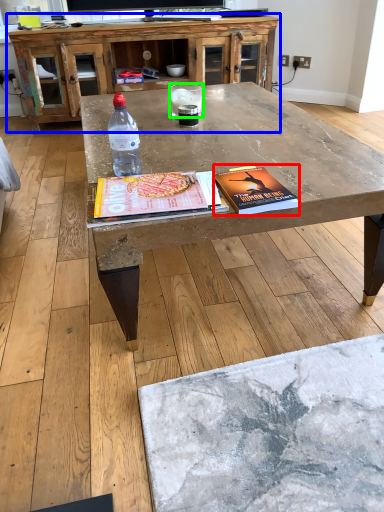
Question: Which is nearer to the paperback book (highlighted by a red box)? cabinetry (highlighted by a blue box) or water (highlighted by a green box).

Choices:
 (A) cabinetry
 (B) water

Answer: (B)